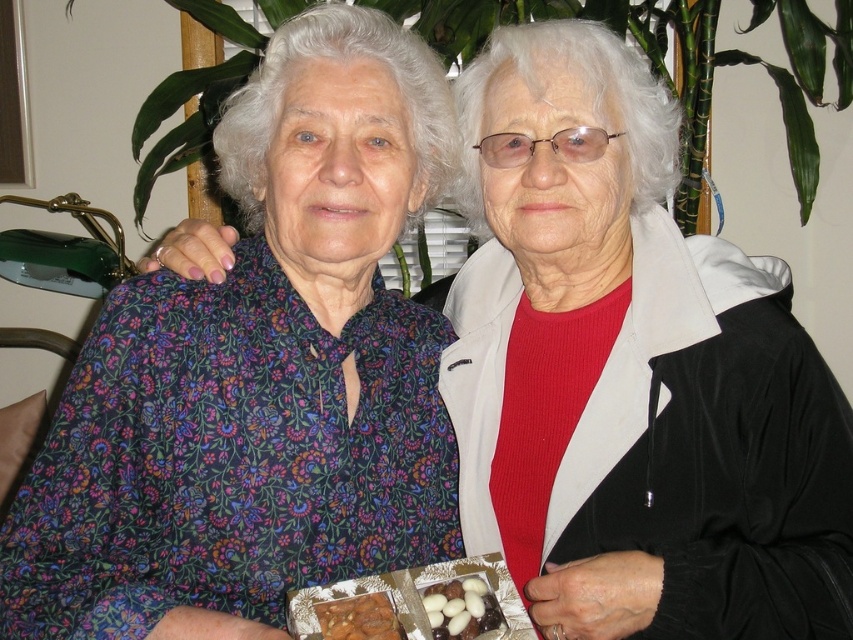
You are a photographer setting up a shot of the two women. You need to ensure that the floral fabric blouse at left and the white glossy candy at lower center are both in focus. Which object should you adjust your camera focus on first if you want to prioritize the closer one?

The white glossy candy at lower center is closer to the camera than the floral fabric blouse at left, so you should focus on the white glossy candy at lower center first to ensure both are in focus.

You are standing in the room and want to place a gift box between the two women. The gift box requires a space that is 10 cm wide. Can you determine if the space between the two women is wide enough based on the position of the matte black jacket at right?

The matte black jacket at right is located at point [630,371], but without knowing the exact positions of the other objects or the required width, it is impossible to determine if the space is sufficient. Please provide more information about the positions of the women or the required dimensions.

You are a tailor measuring jackets for two elderly women. The first woman is wearing a floral fabric blouse at left, and the second is wearing a matte black jacket at right. Which garment has a greater thickness that might require more space in a wardrobe?

The floral fabric blouse at left is thicker than the matte black jacket at right, so it requires more space in the wardrobe.